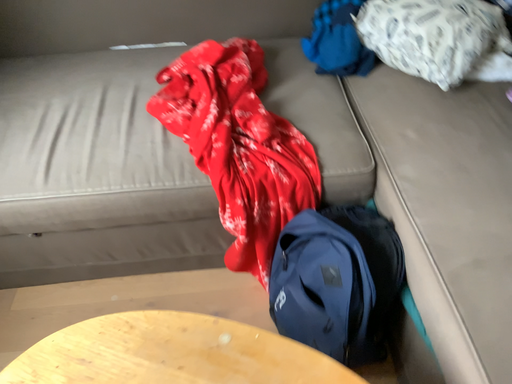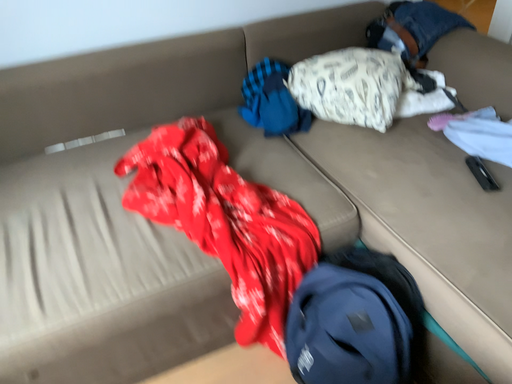
Question: How did the camera likely rotate when shooting the video?

Choices:
 (A) rotated upward
 (B) rotated downward

Answer: (A)